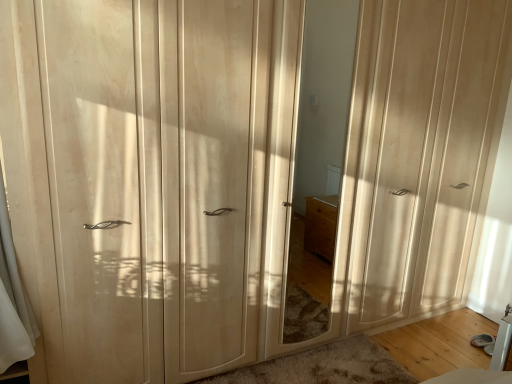
Image resolution: width=512 pixels, height=384 pixels. I want to click on matte wood wardrobe at left, which ranks as the 2th screen door in right-to-left order, so click(x=152, y=185).

Identify the location of matte wood wardrobe at left, marked as the first screen door in a left-to-right arrangement. (152, 185).

Is matte wood mirror at center positioned with its back to matte wood wardrobe at left, which ranks as the 2th screen door in right-to-left order?

No, matte wood mirror at center is not facing the opposite direction of matte wood wardrobe at left, which ranks as the 2th screen door in right-to-left order.

From a real-world perspective, which object rests below the other?

matte wood wardrobe at left, which ranks as the 2th screen door in right-to-left order, is physically lower.

Which object is positioned more to the left, matte wood mirror at center or matte wood wardrobe at left, which ranks as the 2th screen door in right-to-left order?

matte wood wardrobe at left, which ranks as the 2th screen door in right-to-left order.

Can you confirm if matte wood mirror at center is wider than matte wood wardrobe at left, marked as the first screen door in a left-to-right arrangement?

No, matte wood mirror at center is not wider than matte wood wardrobe at left, marked as the first screen door in a left-to-right arrangement.

Considering the relative sizes of matte wood wardrobe at left, which ranks as the 2th screen door in right-to-left order, and matte wood wardrobe at right, acting as the second screen door starting from the left, in the image provided, is matte wood wardrobe at left, which ranks as the 2th screen door in right-to-left order, smaller than matte wood wardrobe at right, acting as the second screen door starting from the left,?

Incorrect, matte wood wardrobe at left, which ranks as the 2th screen door in right-to-left order, is not smaller in size than matte wood wardrobe at right, acting as the second screen door starting from the left.

Does matte wood wardrobe at left, which ranks as the 2th screen door in right-to-left order, appear on the right side of matte wood wardrobe at right, acting as the first screen door starting from the right?

No, matte wood wardrobe at left, which ranks as the 2th screen door in right-to-left order, is not to the right of matte wood wardrobe at right, acting as the first screen door starting from the right.

Would you say matte wood wardrobe at left, marked as the first screen door in a left-to-right arrangement, is outside matte wood wardrobe at right, acting as the second screen door starting from the left?

Yes.

Is matte wood wardrobe at right, acting as the second screen door starting from the left, a part of matte wood mirror at center?

That's incorrect, matte wood wardrobe at right, acting as the second screen door starting from the left, is not inside matte wood mirror at center.

In terms of height, does matte wood mirror at center look taller or shorter compared to matte wood wardrobe at right, acting as the second screen door starting from the left?

Considering their sizes, matte wood mirror at center has less height than matte wood wardrobe at right, acting as the second screen door starting from the left.

Is matte wood wardrobe at right, acting as the first screen door starting from the right, at the back of matte wood mirror at center?

matte wood mirror at center is not turned away from matte wood wardrobe at right, acting as the first screen door starting from the right.

From the image's perspective, is matte wood wardrobe at left, which ranks as the 2th screen door in right-to-left order, positioned above or below matte wood mirror at center?

From the image's perspective, matte wood wardrobe at left, which ranks as the 2th screen door in right-to-left order, appears below matte wood mirror at center.

Are matte wood wardrobe at left, marked as the first screen door in a left-to-right arrangement, and matte wood mirror at center located far from each other?

matte wood wardrobe at left, marked as the first screen door in a left-to-right arrangement, is near matte wood mirror at center, not far away.

Is point (127, 36) closer or farther from the camera than point (324, 287)?

Point (127, 36) is positioned closer to the camera compared to point (324, 287).

Looking at their sizes, would you say matte wood wardrobe at right, acting as the first screen door starting from the right, is wider or thinner than matte wood mirror at center?

Considering their sizes, matte wood wardrobe at right, acting as the first screen door starting from the right, looks broader than matte wood mirror at center.

Is matte wood wardrobe at right, acting as the second screen door starting from the left, directly adjacent to matte wood mirror at center?

No, matte wood wardrobe at right, acting as the second screen door starting from the left, is not next to matte wood mirror at center.

From a real-world perspective, is matte wood wardrobe at right, acting as the second screen door starting from the left, positioned over matte wood mirror at center based on gravity?

Correct, in the physical world, matte wood wardrobe at right, acting as the second screen door starting from the left, is higher than matte wood mirror at center.

From the image's perspective, between matte wood wardrobe at right, acting as the second screen door starting from the left, and matte wood mirror at center, who is located below?

matte wood mirror at center appears lower in the image.

In the image, is matte wood wardrobe at right, acting as the first screen door starting from the right, on the left side or the right side of matte wood wardrobe at left, marked as the first screen door in a left-to-right arrangement?

In the image, matte wood wardrobe at right, acting as the first screen door starting from the right, appears on the right side of matte wood wardrobe at left, marked as the first screen door in a left-to-right arrangement.

From the image's perspective, who appears lower, matte wood wardrobe at right, acting as the second screen door starting from the left, or matte wood wardrobe at left, which ranks as the 2th screen door in right-to-left order?

matte wood wardrobe at left, which ranks as the 2th screen door in right-to-left order, appears lower in the image.

Considering the sizes of objects matte wood wardrobe at right, acting as the second screen door starting from the left, and matte wood wardrobe at left, marked as the first screen door in a left-to-right arrangement, in the image provided, who is taller, matte wood wardrobe at right, acting as the second screen door starting from the left, or matte wood wardrobe at left, marked as the first screen door in a left-to-right arrangement,?

Standing taller between the two is matte wood wardrobe at right, acting as the second screen door starting from the left.

The width and height of the screenshot is (512, 384). I want to click on screen door in front of the matte wood mirror at center, so [x=152, y=185].

At what (x,y) coordinates should I click in order to perform the action: click on screen door below the matte wood wardrobe at right, acting as the first screen door starting from the right (from the image's perspective). Please return your answer as a coordinate pair (x, y). The height and width of the screenshot is (384, 512). Looking at the image, I should click on (152, 185).

Looking at the image, which one is located closer to matte wood wardrobe at right, acting as the second screen door starting from the left, matte wood mirror at center or matte wood wardrobe at left, which ranks as the 2th screen door in right-to-left order?

matte wood mirror at center lies closer to matte wood wardrobe at right, acting as the second screen door starting from the left, than the other object.

Which object lies nearer to the anchor point matte wood wardrobe at left, which ranks as the 2th screen door in right-to-left order, matte wood wardrobe at right, acting as the second screen door starting from the left, or matte wood mirror at center?

matte wood mirror at center is closer to matte wood wardrobe at left, which ranks as the 2th screen door in right-to-left order.

Estimate the real-world distances between objects in this image. Which object is further from matte wood wardrobe at right, acting as the first screen door starting from the right, matte wood wardrobe at left, which ranks as the 2th screen door in right-to-left order, or matte wood mirror at center?

matte wood wardrobe at left, which ranks as the 2th screen door in right-to-left order, is further to matte wood wardrobe at right, acting as the first screen door starting from the right.

From the image, which object appears to be nearer to matte wood mirror at center, matte wood wardrobe at left, which ranks as the 2th screen door in right-to-left order, or matte wood wardrobe at right, acting as the first screen door starting from the right?

matte wood wardrobe at right, acting as the first screen door starting from the right.

Estimate the real-world distances between objects in this image. Which object is further from matte wood mirror at center, matte wood wardrobe at right, acting as the first screen door starting from the right, or matte wood wardrobe at left, marked as the first screen door in a left-to-right arrangement?

Among the two, matte wood wardrobe at left, marked as the first screen door in a left-to-right arrangement, is located further to matte wood mirror at center.

When comparing their distances from matte wood wardrobe at left, marked as the first screen door in a left-to-right arrangement, does matte wood mirror at center or matte wood wardrobe at right, acting as the first screen door starting from the right, seem further?

The object further to matte wood wardrobe at left, marked as the first screen door in a left-to-right arrangement, is matte wood wardrobe at right, acting as the first screen door starting from the right.

At what (x,y) coordinates should I click in order to perform the action: click on mirror between matte wood wardrobe at left, which ranks as the 2th screen door in right-to-left order, and matte wood wardrobe at right, acting as the second screen door starting from the left, in the horizontal direction. Please return your answer as a coordinate pair (x, y). The width and height of the screenshot is (512, 384). Looking at the image, I should click on (305, 192).